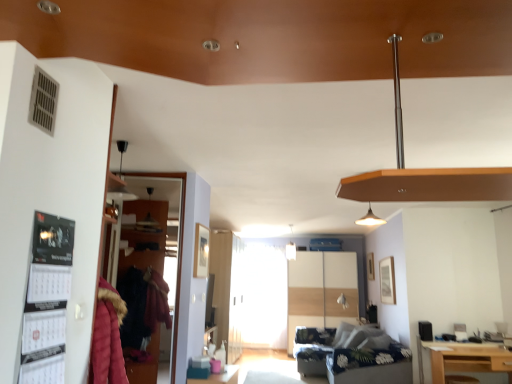
Question: Is black paper calendar at left facing towards transparent glass door at left, which is the first glass door in top-to-bottom order?

Choices:
 (A) yes
 (B) no

Answer: (B)

Question: Is black paper calendar at left in contact with transparent glass door at left, which appears as the 1th glass door when viewed from the left?

Choices:
 (A) no
 (B) yes

Answer: (A)

Question: Is black paper calendar at left turned away from transparent glass door at left, which is the 2th glass door from back to front?

Choices:
 (A) yes
 (B) no

Answer: (B)

Question: Considering the relative positions of black paper calendar at left and transparent glass door at left, arranged as the second glass door when ordered from the bottom, in the image provided, is black paper calendar at left to the left of transparent glass door at left, arranged as the second glass door when ordered from the bottom, from the viewer's perspective?

Choices:
 (A) no
 (B) yes

Answer: (A)

Question: From the image's perspective, is black paper calendar at left below transparent glass door at left, placed as the second glass door when sorted from right to left?

Choices:
 (A) no
 (B) yes

Answer: (A)

Question: From a real-world perspective, is dark blue floral fabric couch at lower center positioned above or below transparent glass door at left, placed as the second glass door when sorted from right to left?

Choices:
 (A) above
 (B) below

Answer: (B)

Question: Is dark blue floral fabric couch at lower center taller or shorter than transparent glass door at left, which is the 1th glass door from front to back?

Choices:
 (A) short
 (B) tall

Answer: (A)

Question: Considering their positions, is dark blue floral fabric couch at lower center located in front of or behind transparent glass door at left, arranged as the second glass door when ordered from the bottom?

Choices:
 (A) front
 (B) behind

Answer: (B)

Question: In the image, is dark blue floral fabric couch at lower center on the left side or the right side of transparent glass door at left, which is the first glass door in top-to-bottom order?

Choices:
 (A) left
 (B) right

Answer: (B)

Question: From a real-world perspective, is transparent glass door at left, which appears as the 1th glass door when viewed from the left, above or below light brown wooden table at lower right?

Choices:
 (A) below
 (B) above

Answer: (B)

Question: In terms of height, does transparent glass door at left, which appears as the 1th glass door when viewed from the left, look taller or shorter compared to light brown wooden table at lower right?

Choices:
 (A) short
 (B) tall

Answer: (B)

Question: In terms of size, does transparent glass door at left, arranged as the second glass door when ordered from the bottom, appear bigger or smaller than light brown wooden table at lower right?

Choices:
 (A) big
 (B) small

Answer: (B)

Question: Does point (182, 198) appear closer or farther from the camera than point (441, 360)?

Choices:
 (A) farther
 (B) closer

Answer: (B)

Question: From a real-world perspective, is dark blue floral fabric couch at lower center positioned above or below light brown wooden table at lower right?

Choices:
 (A) below
 (B) above

Answer: (A)

Question: Is dark blue floral fabric couch at lower center bigger or smaller than light brown wooden table at lower right?

Choices:
 (A) big
 (B) small

Answer: (A)